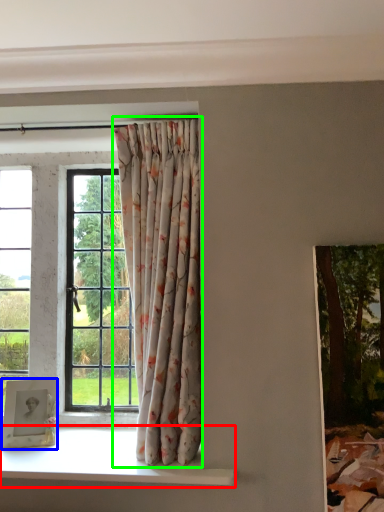
Question: Which object is the farthest from window sill (highlighted by a red box)? Choose among these: picture frame (highlighted by a blue box) or curtain (highlighted by a green box).

Choices:
 (A) picture frame
 (B) curtain

Answer: (B)